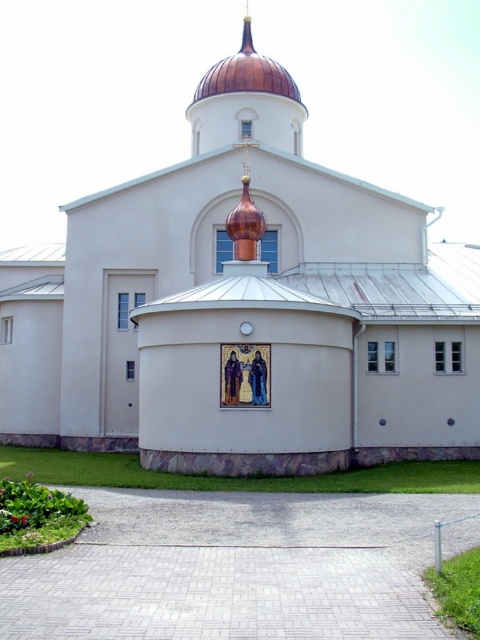
You are standing in front of the white matte church at center and want to take a photo of the copper dome at upper center. Will the dome be fully visible in the photo if you frame the shot with the church in the foreground?

The white matte church at center is in front of the copper dome at upper center, so the dome may be partially or fully blocked by the church in the photo depending on the framing. Adjust the angle or zoom to ensure the dome is visible.

You are standing at the center of a square plaza. In front of you is the white matte church at center. If you walk straight ahead, will you reach the church?

Yes, walking straight ahead from the center of the plaza will lead you directly to the white matte church at center since it is positioned at the central point of the scene.

You are an architect evaluating the proportions of the building. Based on the image, which object is bigger in size between the white matte church at center and the copper dome at upper center?

The white matte church at center has a larger size compared to the copper dome at upper center, so the white matte church at center is bigger in size.